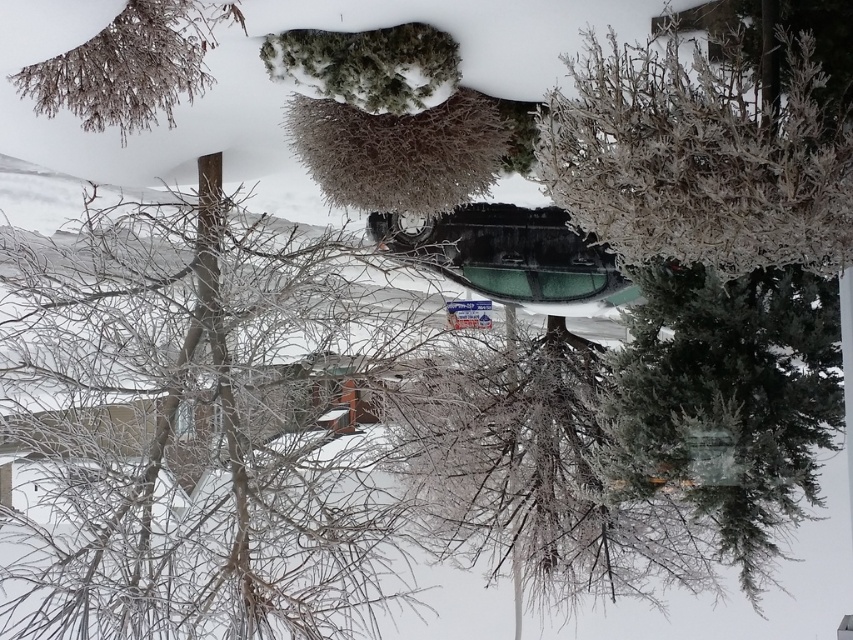
Does frosted white tree at center have a larger size compared to frosted brown branches at upper left?

Indeed, frosted white tree at center has a larger size compared to frosted brown branches at upper left.

Who is more distant from viewer, (x=595, y=58) or (x=109, y=97)?

Point (x=109, y=97)

You are a GUI agent. You are given a task and a screenshot of the screen. Output one action in this format:
    pyautogui.click(x=<x>, y=<y>)
    Task: Click on the frosted white tree at center
    The width and height of the screenshot is (853, 640).
    Given the screenshot: What is the action you would take?
    pyautogui.click(x=699, y=157)

Where is `frosted white tree at center`? The image size is (853, 640). frosted white tree at center is located at coordinates (699, 157).